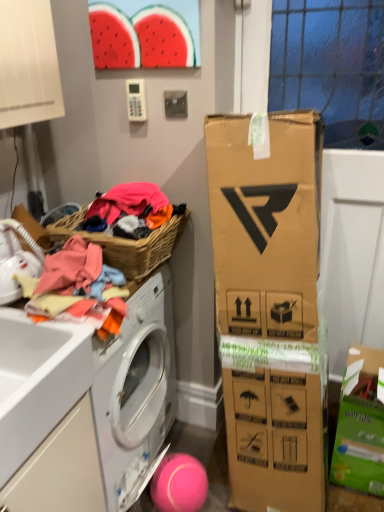
Question: Considering the positions of woven brown picnic basket at left and pink rubber ball at lower center in the image, is woven brown picnic basket at left taller or shorter than pink rubber ball at lower center?

Choices:
 (A) short
 (B) tall

Answer: (A)

Question: Considering the positions of point (155, 259) and point (180, 475), is point (155, 259) closer or farther from the camera than point (180, 475)?

Choices:
 (A) farther
 (B) closer

Answer: (B)

Question: Which object is positioned farthest from the soft cotton clothes at left?

Choices:
 (A) cardboard box at lower right
 (B) pink rubber ball at lower center
 (C) white matte drawer at lower left
 (D) woven brown picnic basket at left

Answer: (A)

Question: Based on their relative distances, which object is nearer to the white matte drawer at lower left?

Choices:
 (A) cardboard box at lower right
 (B) pink rubber ball at lower center
 (C) woven brown picnic basket at left
 (D) soft cotton clothes at left

Answer: (D)